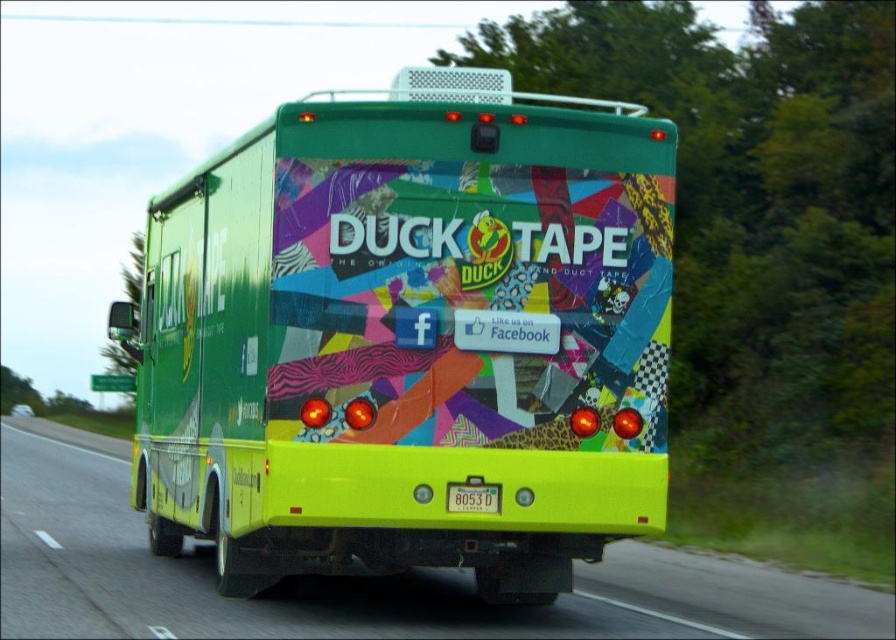
Is point (271, 317) behind point (459, 508)?

No.

Who is positioned more to the right, green matte bus at center or yellow plastic license plate at rear?

green matte bus at center

Who is more forward, (664, 500) or (483, 499)?

Point (483, 499) is in front.

The height and width of the screenshot is (640, 896). Find the location of `green matte bus at center`. green matte bus at center is located at coordinates 409,337.

Can you confirm if green matte bus at center is thinner than yellow glossy bus at center?

Indeed, green matte bus at center has a lesser width compared to yellow glossy bus at center.

Which is behind, point (540, 371) or point (593, 611)?

The point (593, 611) is more distant.

Image resolution: width=896 pixels, height=640 pixels. Identify the location of green matte bus at center. (409, 337).

Is yellow glossy bus at center taller than yellow plastic license plate at rear?

Correct, yellow glossy bus at center is much taller as yellow plastic license plate at rear.

Describe the element at coordinates (399, 577) in the screenshot. This screenshot has width=896, height=640. I see `yellow glossy bus at center` at that location.

Which is behind, point (190, 577) or point (461, 499)?

The point (190, 577) is more distant.

Locate an element on the screen. Image resolution: width=896 pixels, height=640 pixels. yellow glossy bus at center is located at coordinates (399, 577).